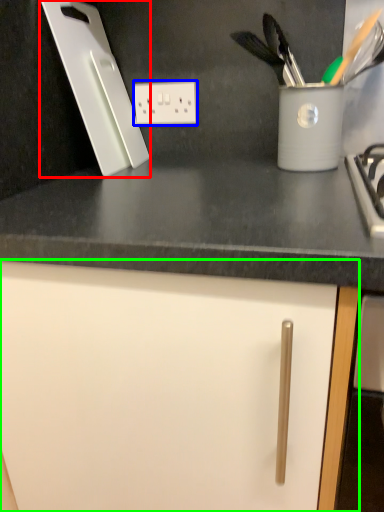
Question: Which object is the closest to the kitchen appliance (highlighted by a red box)? Choose among these: electric outlet (highlighted by a blue box) or cabinetry (highlighted by a green box).

Choices:
 (A) electric outlet
 (B) cabinetry

Answer: (A)